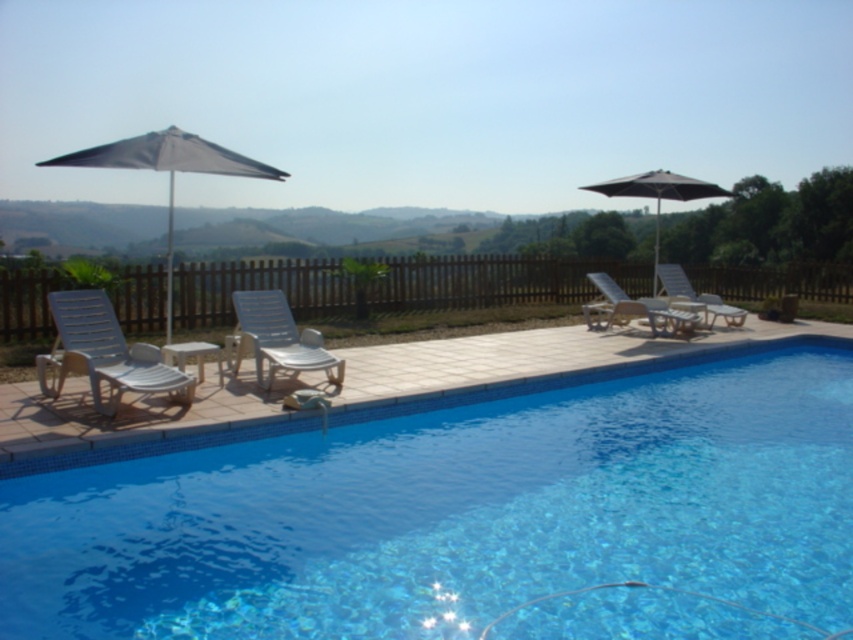
In the scene shown: You are planning to set up a new lounge chair in this outdoor area. You want to place it in a spot where it won not block the view of the rolling hills beyond the fence. Based on the current arrangement of the metallic silver lounge chair at right and the white plastic lounge chair at center right, which chair should you avoid placing your new chair in front of to maintain the view?

You should avoid placing your new chair in front of the metallic silver lounge chair at right because it is located below the white plastic lounge chair at center right, meaning it is closer to the fence and blocking the view of the rolling hills beyond.

You are planning to set up a small table between the metallic silver lounge chair at right and the white plastic lounge chair at center right. Which chair should the table be closer to if you want it to be equidistant from both chairs?

The table should be closer to the white plastic lounge chair at center right because the metallic silver lounge chair at right is larger in size, so positioning the table closer to the smaller chair would help maintain an equal distance between both chairs.

You are standing at the edge of the swimming pool and see two points marked in the scene. The first point is at coordinates point (395, 481) and the second is at point (293, 337). Which of these two points is closer to you?

Point (395, 481) is in front of point (293, 337), so it is closer to you.